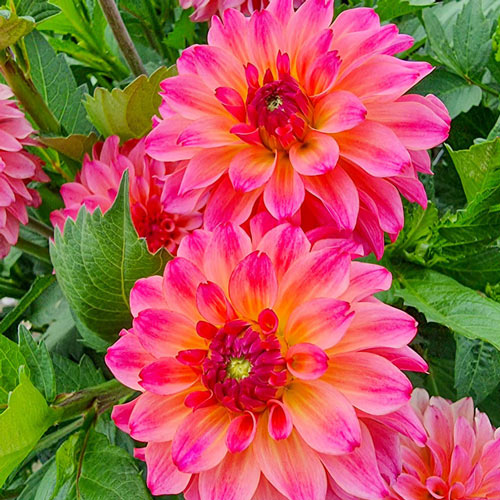
The width and height of the screenshot is (500, 500). In order to click on left most flower in image in this screenshot , I will do [20, 166].